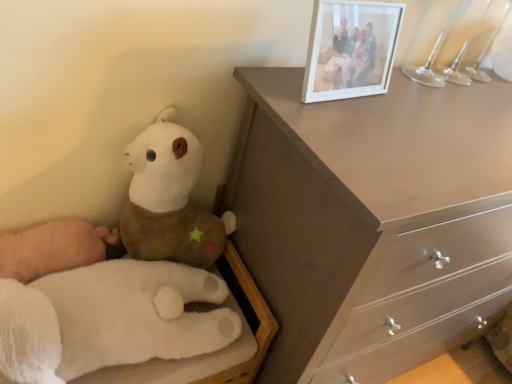
Question: Is white plush hand at lower left, which is the first toy in bottom-to-top order, inside the boundaries of white plastic picture frame at upper right, or outside?

Choices:
 (A) inside
 (B) outside

Answer: (B)

Question: Considering the positions of white plush hand at lower left, the second toy from the top, and white plastic picture frame at upper right in the image, is white plush hand at lower left, the second toy from the top, bigger or smaller than white plastic picture frame at upper right?

Choices:
 (A) small
 (B) big

Answer: (B)

Question: Which object is positioned closest to the matte brown dresser at upper right?

Choices:
 (A) white plush hand at lower left, the second toy from the top
 (B) white plush toy at left, acting as the first toy starting from the top
 (C) white plastic picture frame at upper right

Answer: (C)

Question: Estimate the real-world distances between objects in this image. Which object is closer to the white plush hand at lower left, the second toy from the top?

Choices:
 (A) white plastic picture frame at upper right
 (B) matte brown dresser at upper right
 (C) white plush toy at left, acting as the first toy starting from the top

Answer: (C)